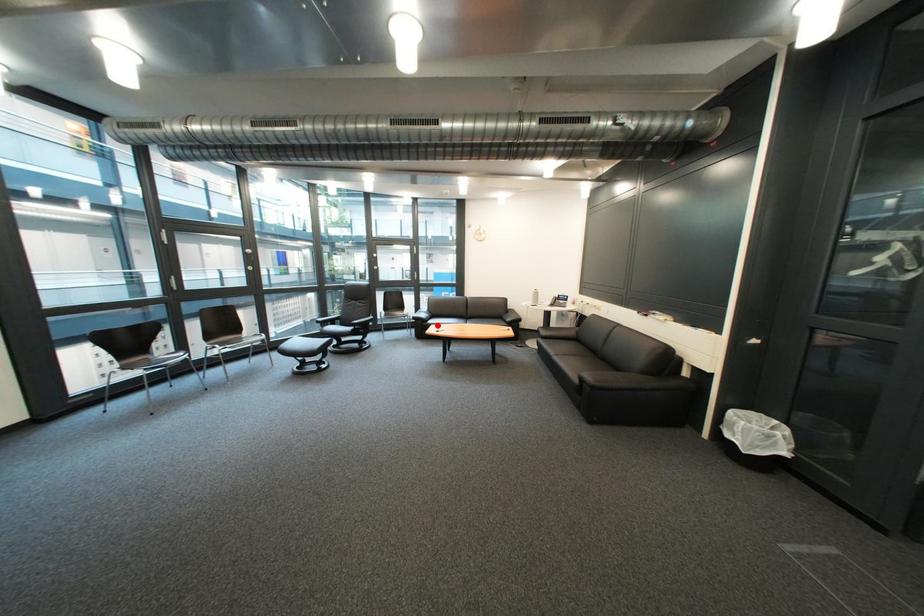
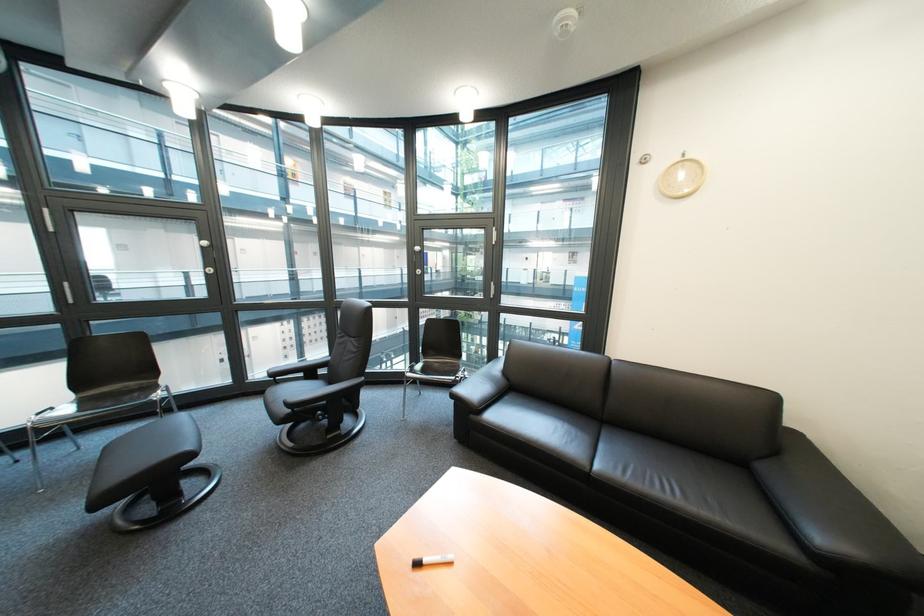
The point at the highlighted location is marked in the first image. Where is the corresponding point in the second image?

(485, 418)